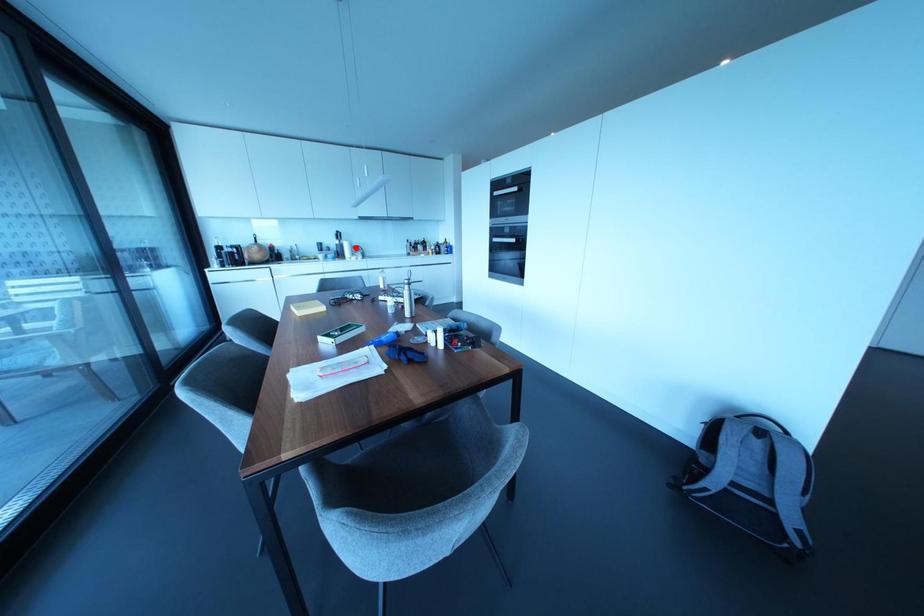
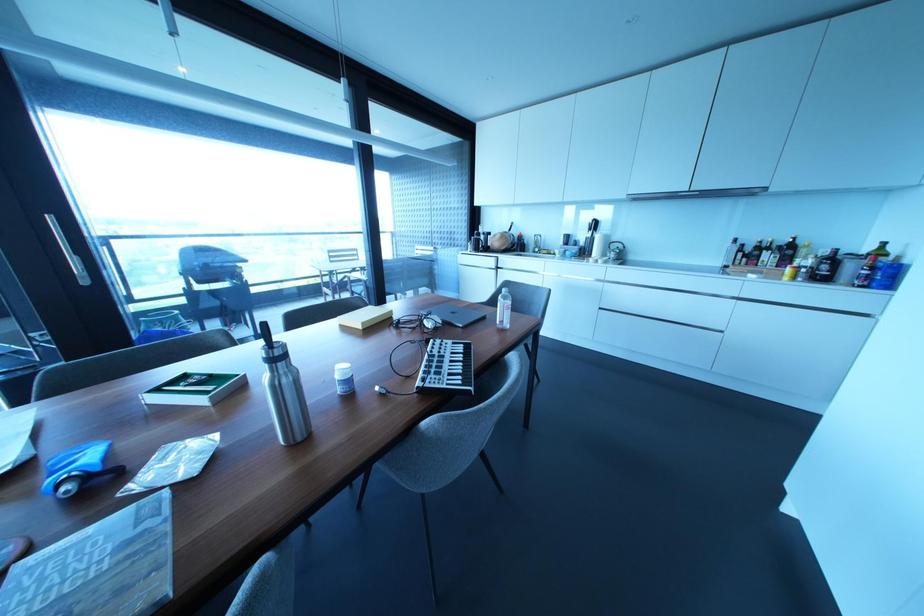
Locate, in the second image, the point that corresponds to the highlighted location in the first image.

(614, 245)